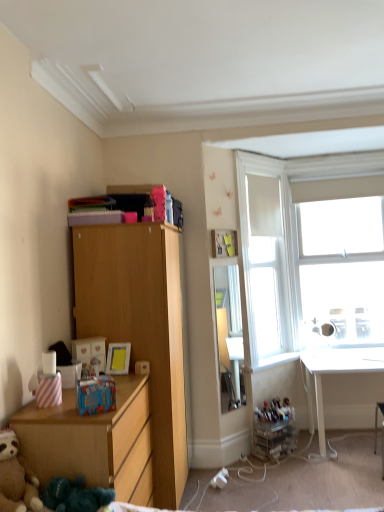
Image resolution: width=384 pixels, height=512 pixels. What do you see at coordinates (343, 265) in the screenshot?
I see `white glass window at upper right` at bounding box center [343, 265].

The image size is (384, 512). What do you see at coordinates (220, 479) in the screenshot?
I see `white plastic power outlet at lower center` at bounding box center [220, 479].

This screenshot has height=512, width=384. Describe the element at coordinates (16, 478) in the screenshot. I see `brown plush teddy bear at lower left` at that location.

This screenshot has height=512, width=384. In order to click on white glass window at upper right in this screenshot , I will do `click(343, 265)`.

Between light wood cabinet at left and brown plush teddy bear at lower left, which one has larger size?

Bigger between the two is light wood cabinet at left.

Locate an element on the screen. teddy bear located underneath the light wood cabinet at left (from a real-world perspective) is located at coordinates (16, 478).

From a real-world perspective, is light wood cabinet at left positioned above or below brown plush teddy bear at lower left?

Clearly, from a real-world perspective, light wood cabinet at left is above brown plush teddy bear at lower left.

Could you tell me if light wood cabinet at left is facing brown plush teddy bear at lower left?

No, light wood cabinet at left is not facing towards brown plush teddy bear at lower left.

Which object is positioned more to the right, white plastic power outlet at lower center or white glossy desk at lower right?

Positioned to the right is white glossy desk at lower right.

What's the angular difference between white plastic power outlet at lower center and white glossy desk at lower right's facing directions?

white plastic power outlet at lower center and white glossy desk at lower right are facing 67.3 degrees away from each other.

Identify the location of power outlet that appears below the white glossy desk at lower right (from the image's perspective). (220, 479).

How many degrees apart are the facing directions of white plastic power outlet at lower center and brown plush teddy bear at lower left?

The angular difference between white plastic power outlet at lower center and brown plush teddy bear at lower left is 10.8 degrees.

Are white plastic power outlet at lower center and brown plush teddy bear at lower left making contact?

There is a gap between white plastic power outlet at lower center and brown plush teddy bear at lower left.

Does white plastic power outlet at lower center come behind brown plush teddy bear at lower left?

Yes, white plastic power outlet at lower center is further from the camera.

From a real-world perspective, which object stands above the other?

In real-world perspective, brown plush teddy bear at lower left is above.

I want to click on desk lying below the white glass window at upper right (from the image's perspective), so click(334, 373).

Considering the positions of objects white glossy desk at lower right and white glass window at upper right in the image provided, who is more to the left, white glossy desk at lower right or white glass window at upper right?

From the viewer's perspective, white glossy desk at lower right appears more on the left side.

Is white glossy desk at lower right looking in the opposite direction of white glass window at upper right?

white glossy desk at lower right is not turned away from white glass window at upper right.

Looking at their sizes, would you say white glossy desk at lower right is wider or thinner than white glass window at upper right?

Considering their sizes, white glossy desk at lower right looks broader than white glass window at upper right.

Which is further, (30,445) or (247,284)?

The point (247,284) is farther.

Considering the sizes of wooden chest of drawers at lower left and white fabric at upper right in the image, is wooden chest of drawers at lower left bigger or smaller than white fabric at upper right?

Considering their sizes, wooden chest of drawers at lower left takes up more space than white fabric at upper right.

Is wooden chest of drawers at lower left taller than white fabric at upper right?

In fact, wooden chest of drawers at lower left may be shorter than white fabric at upper right.

From the image's perspective, is wooden chest of drawers at lower left located above white fabric at upper right?

No, from the image's perspective, wooden chest of drawers at lower left is not over white fabric at upper right.

From the image's perspective, who appears lower, white glass window at upper right or white glossy desk at lower right?

white glossy desk at lower right is shown below in the image.

From a real-world perspective, who is located higher, white glass window at upper right or white glossy desk at lower right?

white glass window at upper right, from a real-world perspective.

Looking at this image, can you tell me how much white glass window at upper right and white glossy desk at lower right differ in facing direction?

0.651 degrees.

Is white glass window at upper right smaller than white glossy desk at lower right?

Yes, white glass window at upper right is smaller than white glossy desk at lower right.

Is white fabric at upper right touching white glossy desk at lower right?

No, white fabric at upper right is not touching white glossy desk at lower right.

From a real-world perspective, which is physically above, white fabric at upper right or white glossy desk at lower right?

white fabric at upper right is physically above.

Is white fabric at upper right at the left side of white glossy desk at lower right?

Indeed, white fabric at upper right is positioned on the left side of white glossy desk at lower right.

What are the coordinates of `teddy bear in front of the light wood cabinet at left` in the screenshot? It's located at (16, 478).

Find the location of a particular element. desk above the white plastic power outlet at lower center (from the image's perspective) is located at coordinates (334, 373).

From the image, which object appears to be farther from matte yellow picture frame at upper center, wooden chest of drawers at lower left or white glass window at upper right?

white glass window at upper right is further to matte yellow picture frame at upper center.

Based on their spatial positions, is white glass window at upper right or light wood cabinet at left closer to white fabric at upper right?

The object closer to white fabric at upper right is white glass window at upper right.

Looking at the image, which one is located further to white glossy desk at lower right, brown plush teddy bear at lower left or matte yellow picture frame at upper center?

Based on the image, brown plush teddy bear at lower left appears to be further to white glossy desk at lower right.

Considering their positions, is white glossy window sill at lower right positioned closer to white glossy desk at lower right than brown plush teddy bear at lower left?

The object closer to white glossy desk at lower right is white glossy window sill at lower right.

Looking at the image, which one is located further to light wood cabinet at left, white plastic power outlet at lower center or brown plush teddy bear at lower left?

white plastic power outlet at lower center is positioned further to the anchor light wood cabinet at left.

Based on their spatial positions, is matte yellow picture frame at upper center or light wood cabinet at left closer to white fabric at upper right?

The object closer to white fabric at upper right is light wood cabinet at left.

Looking at the image, which one is located further to matte yellow picture frame at upper center, white glossy desk at lower right or white plastic power outlet at lower center?

white glossy desk at lower right lies further to matte yellow picture frame at upper center than the other object.

Which object lies further to the anchor point brown plush teddy bear at lower left, matte yellow picture frame at upper center or white glossy desk at lower right?

Based on the image, white glossy desk at lower right appears to be further to brown plush teddy bear at lower left.

This screenshot has height=512, width=384. In order to click on picture frame located between wooden chest of drawers at lower left and white fabric at upper right in the depth direction in this screenshot , I will do `click(118, 358)`.

Where is `picture frame between wooden chest of drawers at lower left and white glass window at upper right in the horizontal direction`? This screenshot has height=512, width=384. picture frame between wooden chest of drawers at lower left and white glass window at upper right in the horizontal direction is located at coordinates (118, 358).

Where is `the chest of drawers located between brown plush teddy bear at lower left and white fabric at upper right in the depth direction`? the chest of drawers located between brown plush teddy bear at lower left and white fabric at upper right in the depth direction is located at coordinates (93, 440).

Where is `the chest of drawers positioned between brown plush teddy bear at lower left and matte yellow picture frame at upper center from near to far`? the chest of drawers positioned between brown plush teddy bear at lower left and matte yellow picture frame at upper center from near to far is located at coordinates (93, 440).